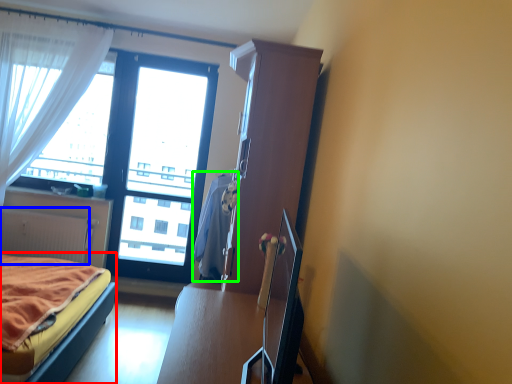
Question: Which object is the closest to the bed (highlighted by a red box)? Choose among these: radiator (highlighted by a blue box) or blanket (highlighted by a green box).

Choices:
 (A) radiator
 (B) blanket

Answer: (B)